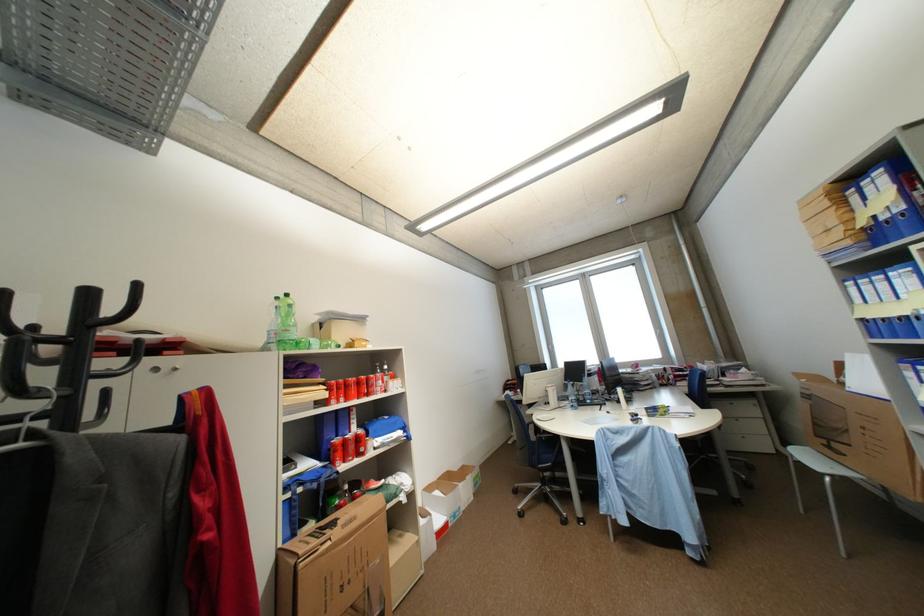
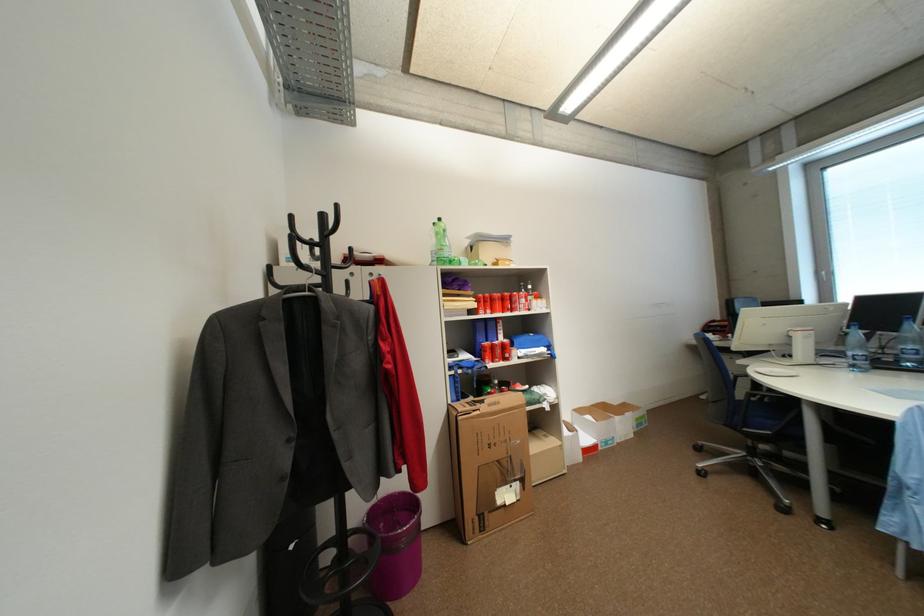
Locate, in the second image, the point that corresponds to (286,300) in the first image.

(443, 225)